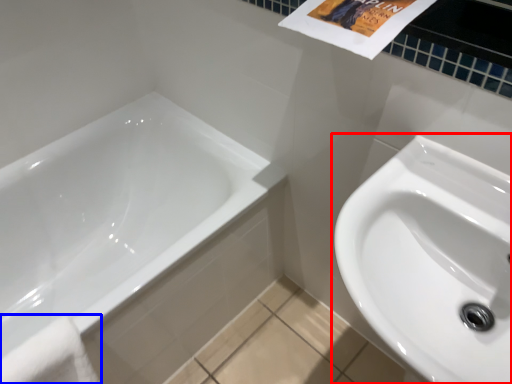
Question: Which of the following is the closest to the observer, sink (highlighted by a red box) or bath towel (highlighted by a blue box)?

Choices:
 (A) sink
 (B) bath towel

Answer: (A)